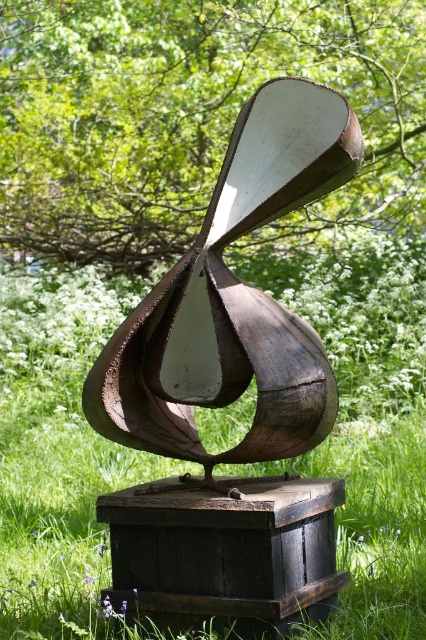
Question: Which of these objects is positioned farthest from the dark brown wooden box at center?

Choices:
 (A) brown wooden sculpture at center
 (B) green matte tree at upper center
 (C) rusty metal abstract at center

Answer: (B)

Question: Is brown wooden sculpture at center thinner than rusty metal abstract at center?

Choices:
 (A) yes
 (B) no

Answer: (B)

Question: Is brown wooden sculpture at center to the left of dark brown wooden box at center from the viewer's perspective?

Choices:
 (A) yes
 (B) no

Answer: (B)

Question: Among these points, which one is farthest from the camera?

Choices:
 (A) (135, 166)
 (B) (58, 492)
 (C) (189, 260)

Answer: (A)

Question: Among these points, which one is farthest from the camera?

Choices:
 (A) (154, 614)
 (B) (267, 397)
 (C) (166, 208)

Answer: (C)

Question: Does brown wooden sculpture at center appear on the right side of rusty metal abstract at center?

Choices:
 (A) no
 (B) yes

Answer: (B)